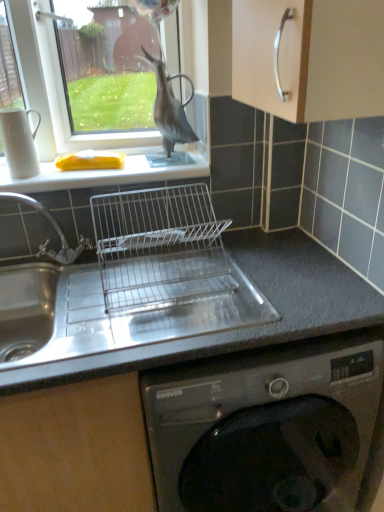
This screenshot has width=384, height=512. Identify the location of blank space to the left of matte black bird at upper center. [x=125, y=159].